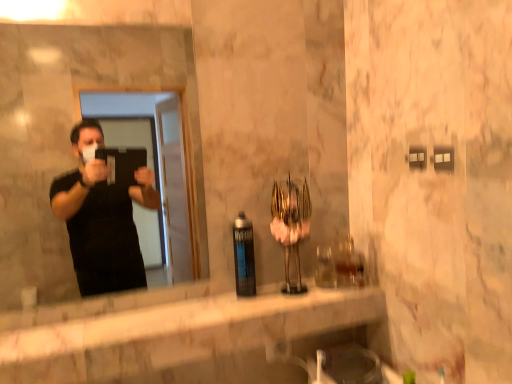
Find the location of a particular element. white marble counter at center is located at coordinates (190, 338).

From a real-world perspective, who is located lower, matte black spray can at center or matte black mirror at left?

matte black spray can at center.

Does matte black spray can at center appear on the left side of matte black mirror at left?

Incorrect, matte black spray can at center is not on the left side of matte black mirror at left.

Is matte black spray can at center not close to matte black mirror at left?

Indeed, matte black spray can at center is not near matte black mirror at left.

From the image's perspective, which is below, matte black spray can at center or matte black mirror at left?

From the image's view, matte black spray can at center is below.

Visually, is white marble counter at center positioned to the left or to the right of matte black mirror at left?

In the image, white marble counter at center appears on the right side of matte black mirror at left.

Is white marble counter at center bigger or smaller than matte black mirror at left?

white marble counter at center is bigger than matte black mirror at left.

Is white marble counter at center turned away from matte black mirror at left?

white marble counter at center does not have its back to matte black mirror at left.

Considering the relative sizes of white marble counter at center and matte black mirror at left in the image provided, is white marble counter at center wider than matte black mirror at left?

Yes.

Where is `bottle above the white marble counter at center (from a real-world perspective)`? bottle above the white marble counter at center (from a real-world perspective) is located at coordinates (244, 256).

Does matte black spray can at center touch white marble counter at center?

matte black spray can at center and white marble counter at center are not in contact.

Is matte black spray can at center to the left of white marble counter at center from the viewer's perspective?

Incorrect, matte black spray can at center is not on the left side of white marble counter at center.

Between matte black spray can at center and white marble counter at center, which one has larger size?

white marble counter at center.

Is the surface of matte black mirror at left in direct contact with white marble counter at center?

No, matte black mirror at left is not with white marble counter at center.

Which is correct: matte black mirror at left is inside white marble counter at center, or outside of it?

matte black mirror at left is spatially situated outside white marble counter at center.

Considering the positions of objects matte black mirror at left and white marble counter at center in the image provided, who is behind, matte black mirror at left or white marble counter at center?

matte black mirror at left is further from the camera.

Is matte black mirror at left at the right side of white marble counter at center?

In fact, matte black mirror at left is to the left of white marble counter at center.

From the image's perspective, which one is positioned lower, white marble counter at center or matte black spray can at center?

white marble counter at center.

Consider the image. In terms of width, does white marble counter at center look wider or thinner when compared to matte black spray can at center?

white marble counter at center is wider than matte black spray can at center.

Is white marble counter at center positioned with its back to matte black spray can at center?

No, matte black spray can at center is not at the back of white marble counter at center.

From a real-world perspective, which is physically below, white marble counter at center or matte black spray can at center?

In real-world perspective, white marble counter at center is lower.

Based on the photo, between matte black mirror at left and matte black spray can at center, which one is positioned behind?

matte black spray can at center is further away from the camera.

Is matte black mirror at left facing away from matte black spray can at center?

No, matte black mirror at left's orientation is not away from matte black spray can at center.

Which of these two, matte black mirror at left or matte black spray can at center, is bigger?

With larger size is matte black mirror at left.

Is point (51, 246) positioned in front of point (240, 253)?

No, (51, 246) is further to viewer.

Locate an element on the screen. This screenshot has height=384, width=512. mirror on the left of the matte black spray can at center is located at coordinates (69, 130).

You are a GUI agent. You are given a task and a screenshot of the screen. Output one action in this format:
    pyautogui.click(x=<x>, y=<y>)
    Task: Click on the mirror above the white marble counter at center (from a real-world perspective)
    
    Given the screenshot: What is the action you would take?
    pyautogui.click(x=69, y=130)

From the image, which object appears to be nearer to matte black spray can at center, white marble counter at center or matte black mirror at left?

white marble counter at center lies closer to matte black spray can at center than the other object.

From the image, which object appears to be nearer to white marble counter at center, matte black mirror at left or matte black spray can at center?

matte black spray can at center lies closer to white marble counter at center than the other object.

From the image, which object appears to be nearer to matte black mirror at left, matte black spray can at center or white marble counter at center?

white marble counter at center is closer to matte black mirror at left.

Estimate the real-world distances between objects in this image. Which object is further from matte black spray can at center, matte black mirror at left or white marble counter at center?

matte black mirror at left is positioned further to the anchor matte black spray can at center.

From the image, which object appears to be nearer to matte black mirror at left, white marble counter at center or matte black spray can at center?

white marble counter at center is positioned closer to the anchor matte black mirror at left.

Estimate the real-world distances between objects in this image. Which object is further from white marble counter at center, matte black spray can at center or matte black mirror at left?

matte black mirror at left.

The width and height of the screenshot is (512, 384). I want to click on bottle between matte black mirror at left and white marble counter at center from top to bottom, so click(x=244, y=256).